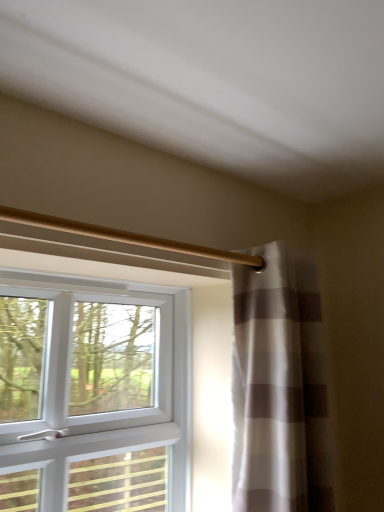
Question: Considering the relative sizes of gold metallic curtain rod at upper center and white plastic window at left in the image provided, is gold metallic curtain rod at upper center wider than white plastic window at left?

Choices:
 (A) yes
 (B) no

Answer: (B)

Question: From the image's perspective, is gold metallic curtain rod at upper center on white plastic window at left?

Choices:
 (A) yes
 (B) no

Answer: (A)

Question: Is gold metallic curtain rod at upper center positioned behind white plastic window at left?

Choices:
 (A) yes
 (B) no

Answer: (B)

Question: Is gold metallic curtain rod at upper center in contact with white plastic window at left?

Choices:
 (A) yes
 (B) no

Answer: (B)

Question: Can you confirm if gold metallic curtain rod at upper center is smaller than white plastic window at left?

Choices:
 (A) yes
 (B) no

Answer: (A)

Question: Considering the relative positions of gold metallic curtain rod at upper center and white plastic window at left in the image provided, is gold metallic curtain rod at upper center to the right of white plastic window at left from the viewer's perspective?

Choices:
 (A) yes
 (B) no

Answer: (A)

Question: Considering the relative sizes of white plastic window at left and white striped curtain at right in the image provided, is white plastic window at left bigger than white striped curtain at right?

Choices:
 (A) yes
 (B) no

Answer: (A)

Question: Is there a large distance between white plastic window at left and white striped curtain at right?

Choices:
 (A) yes
 (B) no

Answer: (B)

Question: Is white plastic window at left surrounding white striped curtain at right?

Choices:
 (A) no
 (B) yes

Answer: (A)

Question: From a real-world perspective, does white plastic window at left sit lower than white striped curtain at right?

Choices:
 (A) yes
 (B) no

Answer: (A)

Question: Is the surface of white plastic window at left in direct contact with white striped curtain at right?

Choices:
 (A) yes
 (B) no

Answer: (B)

Question: Does white plastic window at left have a lesser height compared to white striped curtain at right?

Choices:
 (A) yes
 (B) no

Answer: (A)

Question: Is white striped curtain at right oriented away from white plastic window at left?

Choices:
 (A) yes
 (B) no

Answer: (B)